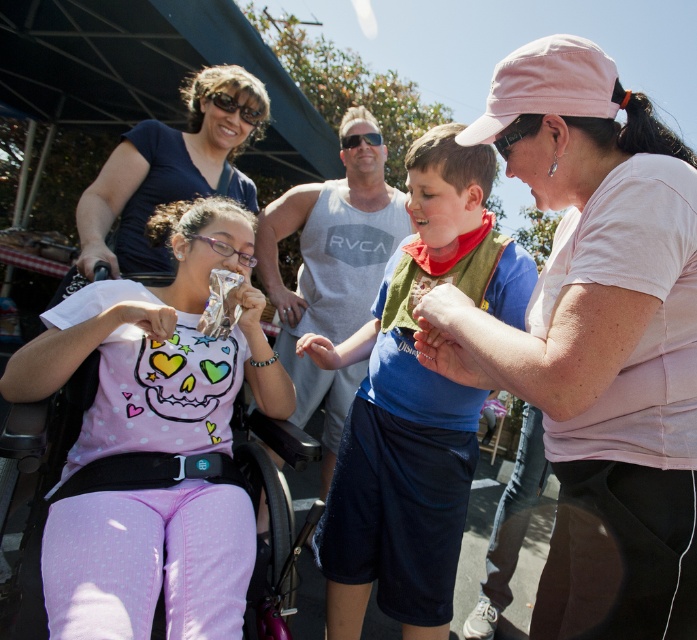
Question: Does pink cotton cap at upper right lie behind matte blue shirt at upper left?

Choices:
 (A) yes
 (B) no

Answer: (B)

Question: Which is nearer to the matte blue shirt at upper left?

Choices:
 (A) pink cotton cap at upper right
 (B) pink matte shirt at center

Answer: (B)

Question: Is pink cotton cap at upper right bigger than matte blue shirt at upper left?

Choices:
 (A) yes
 (B) no

Answer: (B)

Question: Considering the real-world distances, which object is farthest from the pink cotton cap at upper right?

Choices:
 (A) pink matte shirt at center
 (B) blue cotton shirt at center
 (C) matte blue shirt at upper left

Answer: (C)

Question: Does pink matte shirt at center appear on the right side of blue cotton shirt at center?

Choices:
 (A) yes
 (B) no

Answer: (B)

Question: Which point is closer to the camera?

Choices:
 (A) (155, 244)
 (B) (121, 554)

Answer: (B)